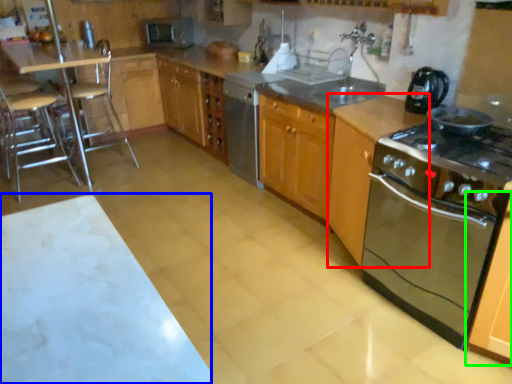
Question: Based on their relative distances, which object is farther from cabinetry (highlighted by a red box)? Choose from table (highlighted by a blue box) and cabinetry (highlighted by a green box).

Choices:
 (A) table
 (B) cabinetry

Answer: (A)